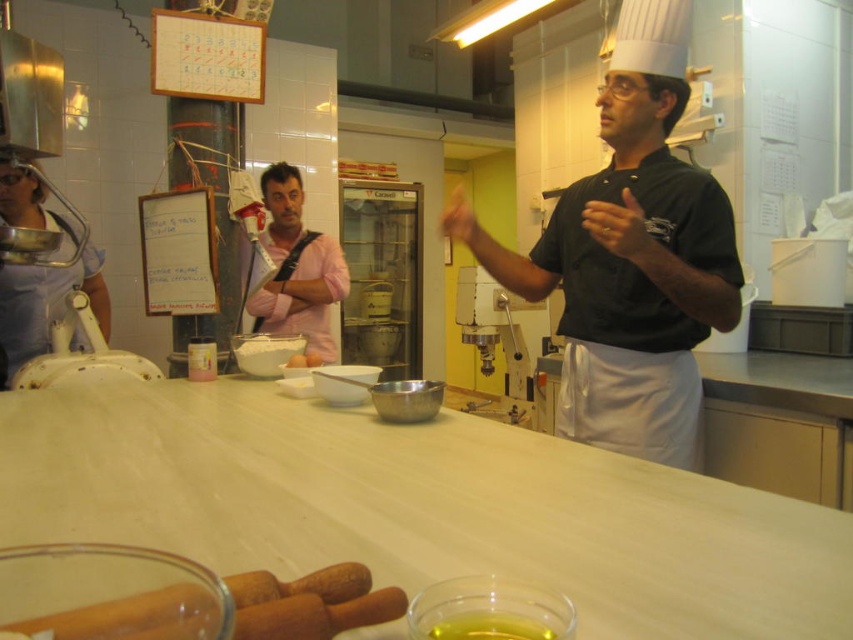
Question: Which of the following is the farthest from the observer?

Choices:
 (A) yellow matte hand at center
 (B) white matte bowl at center
 (C) black matte chef's jacket at center

Answer: (B)

Question: Can you confirm if white matte counter at center is positioned above pink shirt at center?

Choices:
 (A) yes
 (B) no

Answer: (B)

Question: Based on their relative distances, which object is farther from the gold metallic ring at upper center?

Choices:
 (A) yellow matte hand at center
 (B) pink shirt at center
 (C) white matte counter at center

Answer: (B)

Question: Which point is closer to the camera taking this photo?

Choices:
 (A) (323, 246)
 (B) (614, 230)

Answer: (B)

Question: Can you confirm if white matte counter at center is smaller than white matte bowl at center?

Choices:
 (A) no
 (B) yes

Answer: (A)

Question: Can you confirm if white matte counter at center is positioned below white matte bowl at center?

Choices:
 (A) yes
 (B) no

Answer: (A)